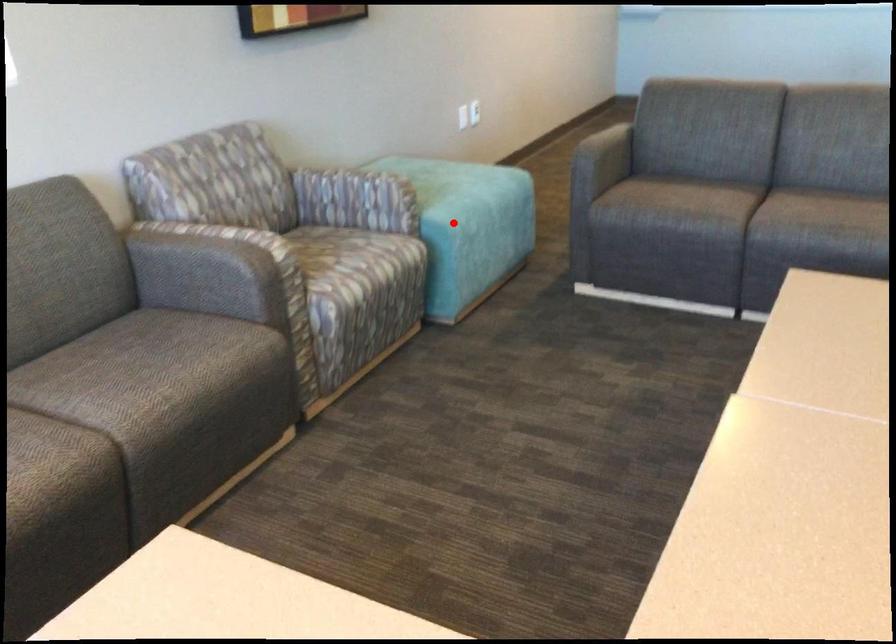
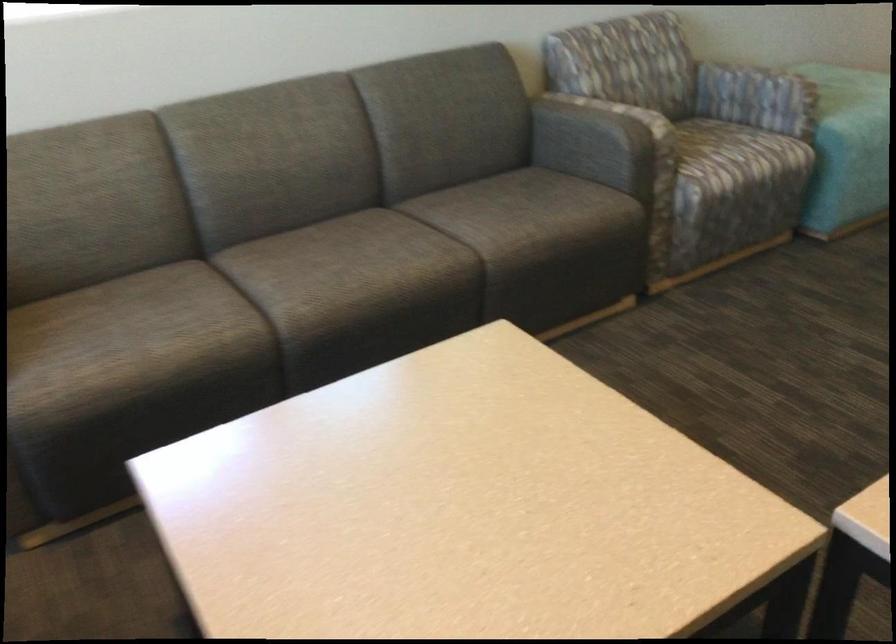
Where in the second image is the point corresponding to the highlighted location from the first image?

(854, 129)